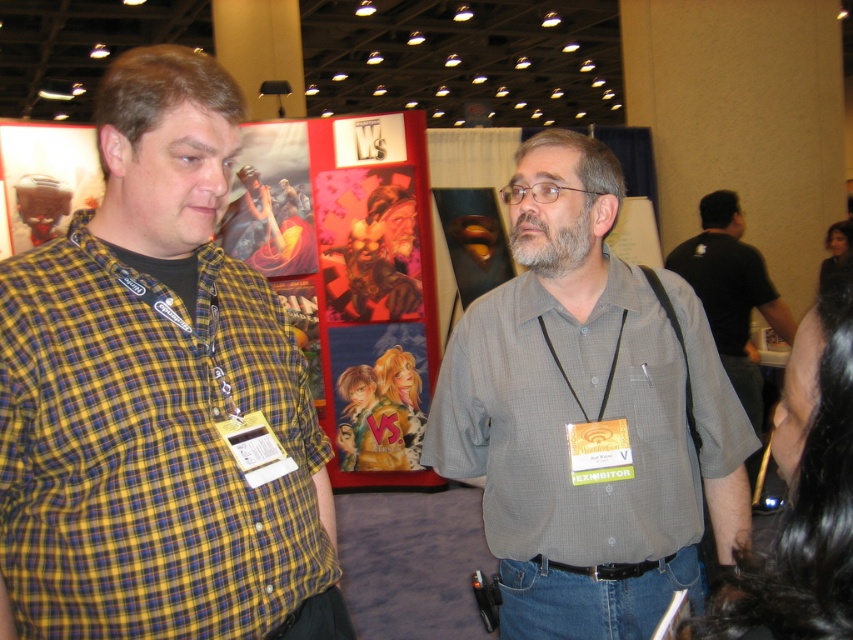
Question: Does gray checkered shirt at center appear under black shirt at right?

Choices:
 (A) no
 (B) yes

Answer: (B)

Question: Among these objects, which one is farthest from the camera?

Choices:
 (A) gray checkered shirt at center
 (B) yellow plaid shirt at left
 (C) black shirt at right

Answer: (C)

Question: Can you confirm if gray checkered shirt at center is positioned below black shirt at right?

Choices:
 (A) no
 (B) yes

Answer: (B)

Question: Which of the following is the farthest from the observer?

Choices:
 (A) (297, 499)
 (B) (625, 275)

Answer: (B)

Question: Is gray checkered shirt at center behind black shirt at right?

Choices:
 (A) no
 (B) yes

Answer: (A)

Question: Which point is farther to the camera?

Choices:
 (A) (730, 339)
 (B) (490, 304)

Answer: (A)